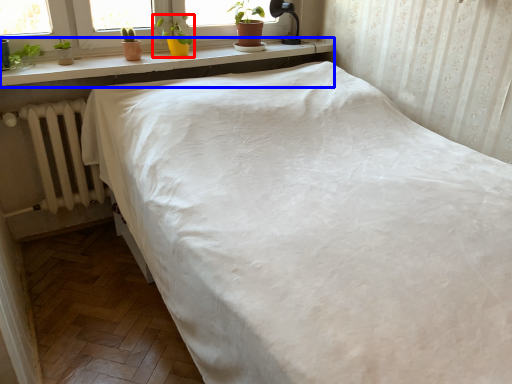
Question: Which of the following is the farthest to the observer, houseplant (highlighted by a red box) or window sill (highlighted by a blue box)?

Choices:
 (A) houseplant
 (B) window sill

Answer: (A)